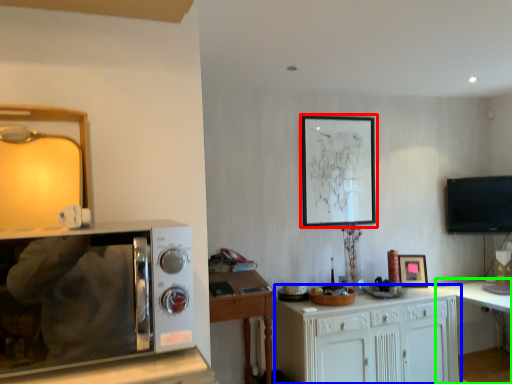
Question: Which object is positioned farthest from picture frame (highlighted by a red box)? Select from cabinetry (highlighted by a blue box) and table (highlighted by a green box).

Choices:
 (A) cabinetry
 (B) table

Answer: (B)